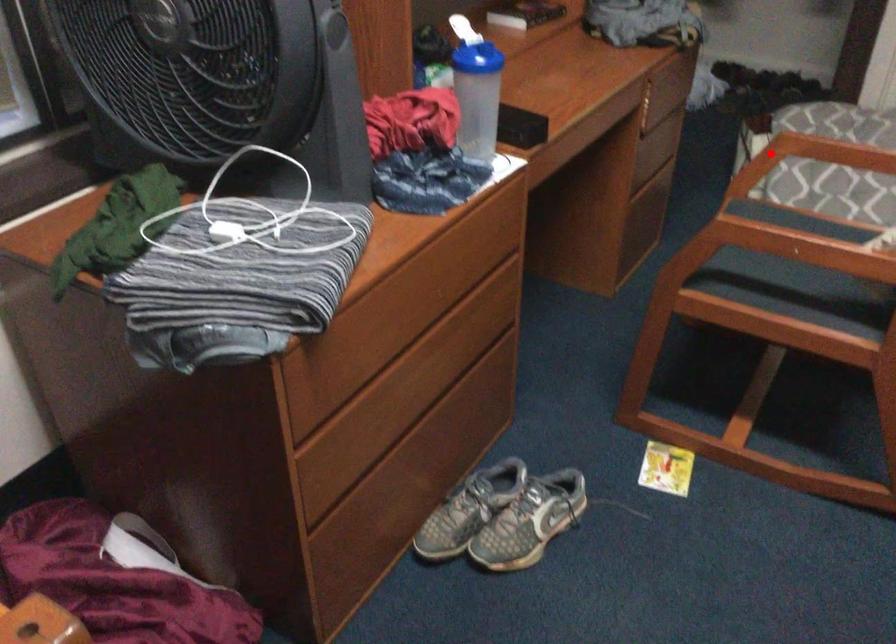
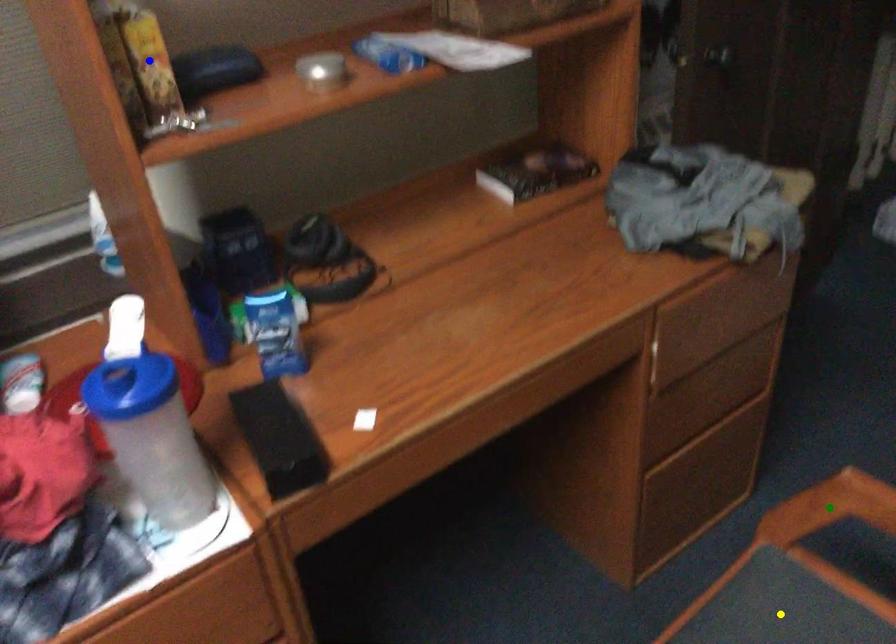
Question: I am providing you with two images of the same scene from different viewpoints. A red point is marked on the first image. You are given multiple points on the second image. In image 2, which mark is for the same physical point as the one in image 1?

Choices:
 (A) green point
 (B) yellow point
 (C) blue point

Answer: (A)